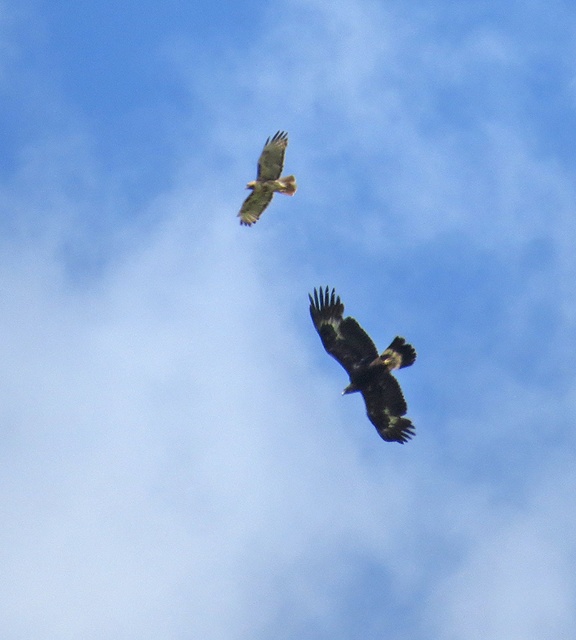
Does dark brown feathers at center appear under brown feathered eagle at upper center?

Yes, dark brown feathers at center is below brown feathered eagle at upper center.

Measure the distance between dark brown feathers at center and camera.

dark brown feathers at center and camera are 202.36 feet apart from each other.

Does point (335, 337) come closer to viewer compared to point (248, 224)?

That is True.

You are a GUI agent. You are given a task and a screenshot of the screen. Output one action in this format:
    pyautogui.click(x=<x>, y=<y>)
    Task: Click on the dark brown feathers at center
    This screenshot has height=640, width=576.
    Given the screenshot: What is the action you would take?
    pyautogui.click(x=365, y=364)